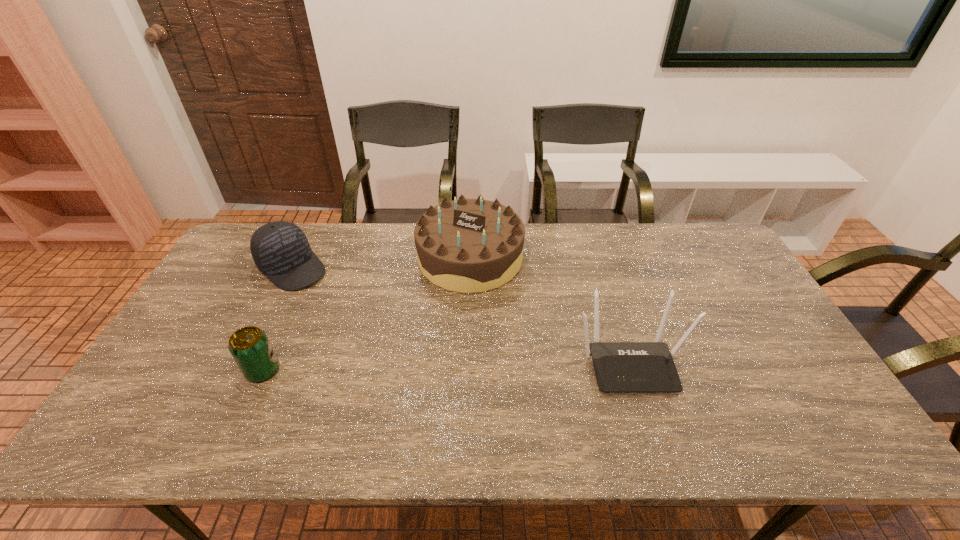
The image size is (960, 540). I want to click on free space on the desktop that is between the beer can and the router and is positioned at the front of the baseball cap where the brim is located, so click(x=409, y=367).

You are a GUI agent. You are given a task and a screenshot of the screen. Output one action in this format:
    pyautogui.click(x=<x>, y=<y>)
    Task: Click on the vacant space on the desktop that is between the beer can and the rightmost object and is positioned on the front-facing side of the third object from left to right
    This screenshot has height=540, width=960.
    Given the screenshot: What is the action you would take?
    pyautogui.click(x=452, y=367)